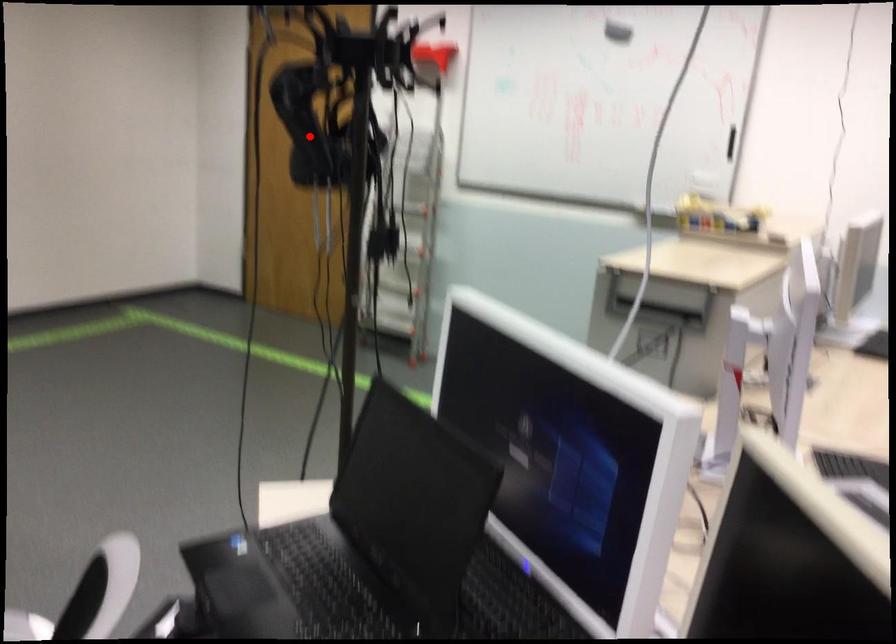
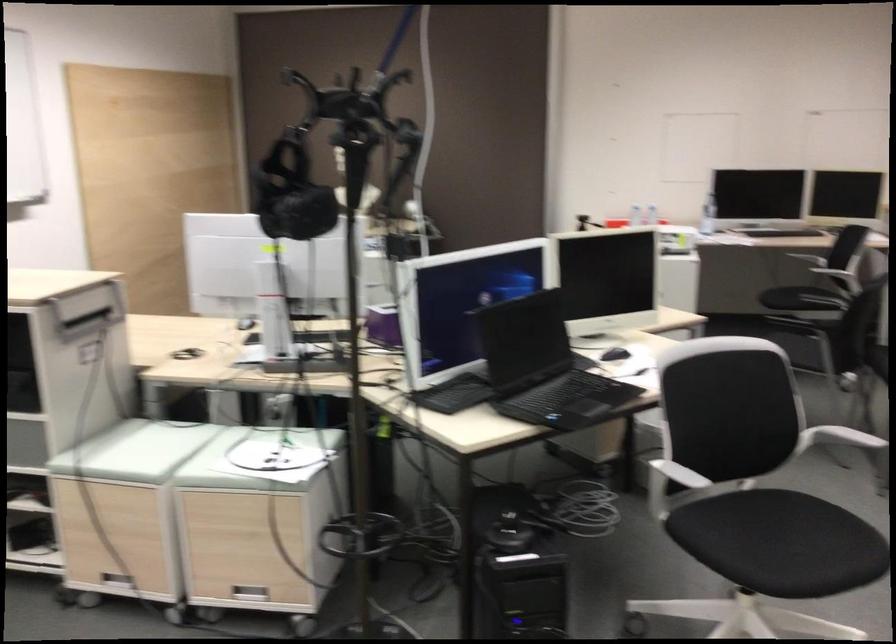
Find the pixel in the second image that matches the highlighted location in the first image.

(291, 192)